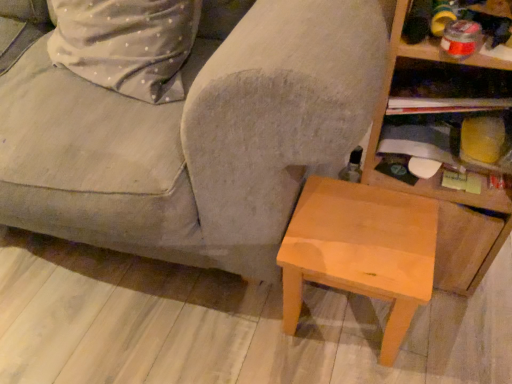
Question: Can you confirm if light brown wood stool at lower right is positioned to the left of wooden shelf at upper right, the 1th shelf positioned from the top?

Choices:
 (A) no
 (B) yes

Answer: (B)

Question: Is light brown wood stool at lower right not within wooden shelf at upper right, the 1th shelf positioned from the top?

Choices:
 (A) yes
 (B) no

Answer: (A)

Question: From the image's perspective, is light brown wood stool at lower right under wooden shelf at upper right, the 1th shelf positioned from the top?

Choices:
 (A) yes
 (B) no

Answer: (A)

Question: Is light brown wood stool at lower right positioned far away from wooden shelf at upper right, the 1th shelf positioned from the top?

Choices:
 (A) yes
 (B) no

Answer: (B)

Question: Is the depth of light brown wood stool at lower right greater than that of wooden shelf at upper right, the 1th shelf positioned from the top?

Choices:
 (A) no
 (B) yes

Answer: (A)

Question: Considering the positions of point (284, 329) and point (409, 51), is point (284, 329) closer or farther from the camera than point (409, 51)?

Choices:
 (A) farther
 (B) closer

Answer: (A)

Question: From the image's perspective, relative to wooden at right, positioned as the second shelf in top-to-bottom order, is light brown wood stool at lower right above or below?

Choices:
 (A) above
 (B) below

Answer: (B)

Question: In terms of size, does light brown wood stool at lower right appear bigger or smaller than wooden at right, the first shelf when ordered from bottom to top?

Choices:
 (A) small
 (B) big

Answer: (A)

Question: From a real-world perspective, is light brown wood stool at lower right above or below wooden at right, the first shelf when ordered from bottom to top?

Choices:
 (A) below
 (B) above

Answer: (A)

Question: In terms of width, does gray fabric couch at center look wider or thinner when compared to wooden at right, the first shelf when ordered from bottom to top?

Choices:
 (A) thin
 (B) wide

Answer: (B)

Question: In terms of height, does gray fabric couch at center look taller or shorter compared to wooden at right, the first shelf when ordered from bottom to top?

Choices:
 (A) tall
 (B) short

Answer: (A)

Question: Visually, is gray fabric couch at center positioned to the left or to the right of wooden at right, positioned as the second shelf in top-to-bottom order?

Choices:
 (A) left
 (B) right

Answer: (A)

Question: Is gray fabric couch at center in front of or behind wooden at right, positioned as the second shelf in top-to-bottom order, in the image?

Choices:
 (A) front
 (B) behind

Answer: (A)

Question: From a real-world perspective, is gray fabric couch at center above or below wooden shelf at upper right, the 1th shelf positioned from the top?

Choices:
 (A) below
 (B) above

Answer: (A)

Question: From the image's perspective, relative to wooden shelf at upper right, the 1th shelf positioned from the top, is gray fabric couch at center above or below?

Choices:
 (A) below
 (B) above

Answer: (B)